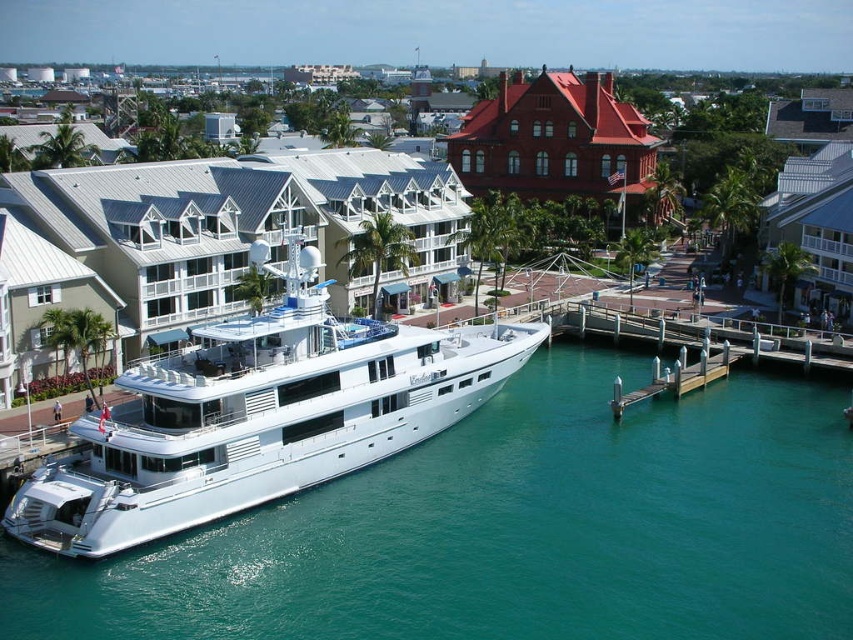
You are a tourist standing on the wooden pier and want to take a photo of the white glossy cruise ship at center and the red brick building at upper center. Which object should you position to your left to include both in the frame?

You should position the white glossy cruise ship at center to your left since it is already to the left of the red brick building at upper center. This way, both objects will be in the frame with the cruise ship on the left and the building on the right.

Based on the photo, you are a photographer planning to take a photo of the waterfront scene. You want to ensure both the red brick building at upper center and the wooden dock at lower right are clearly visible in your shot. Considering their heights, which object will appear taller in the photo?

The red brick building at upper center will appear taller in the photo because it has a greater height compared to the wooden dock at lower right.

You are a photographer planning to capture the red brick building at upper center and the wooden dock at lower right in a single frame. Given their sizes, which object will appear wider in the photo?

The red brick building at upper center will appear wider in the photo because its width is larger than that of the wooden dock at lower right according to the description.